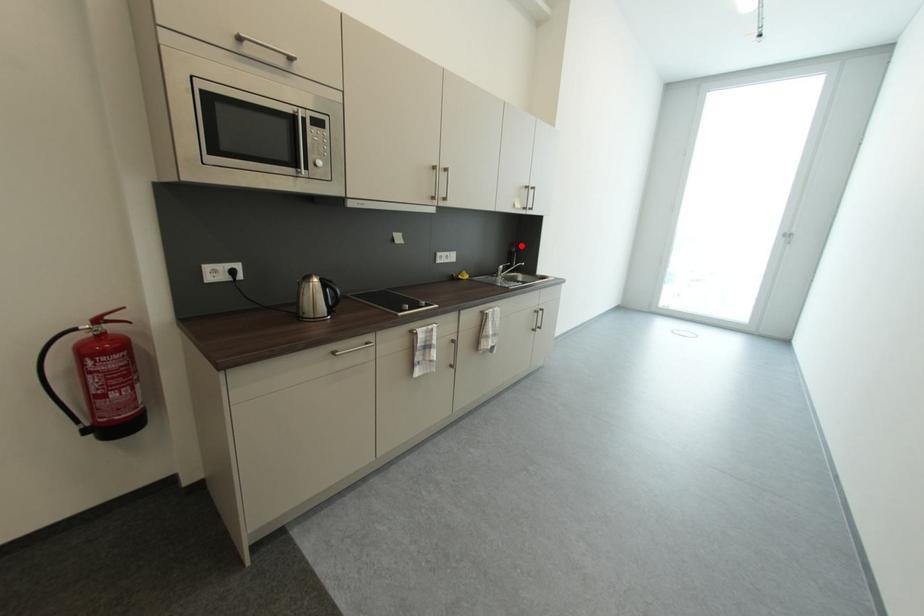
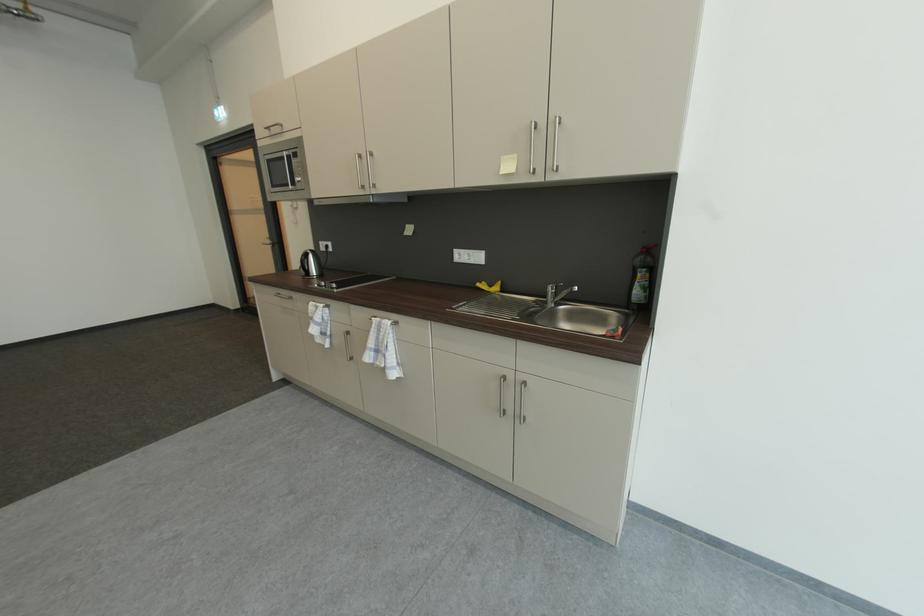
Find the pixel in the second image that matches the highlighted location in the first image.

(650, 252)